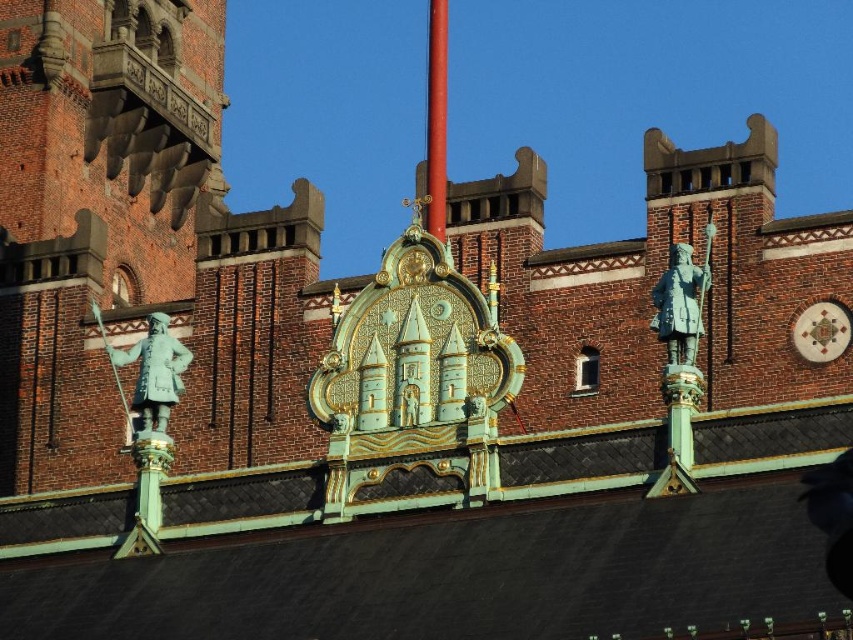
You are standing 200 feet away from a building with a decorative emblem at its center. There is a point marked at coordinates point(171,378). Can you determine if the point is closer to you than the emblem?

The distance of point(171,378) from viewer is 213.25 feet, so the point is farther away than the emblem which is 200 feet away from you. Therefore, the point is not closer to you than the emblem.

You are an architect examining the roofline of a historic building. You notice a green patina statue at upper right located at point (x=682, y=301). Can you determine if this statue is positioned closer to the edge of the roof or near the center?

The green patina statue at upper right is located at point (x=682, y=301), which is closer to the edge of the roof than the center.

You are standing on the ground looking up at the building. Which object is closer to you between the green patina statue at upper right and the red polished metal pole at center?

The green patina statue at upper right is closer to you because it is in front of the red polished metal pole at center.